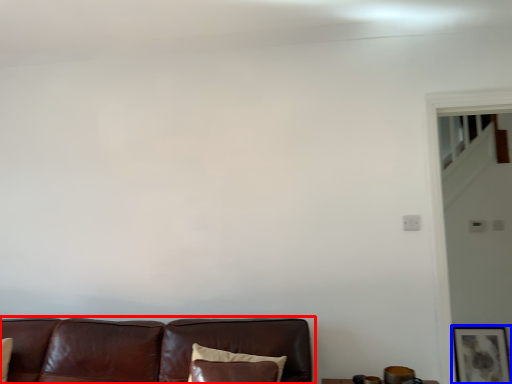
Question: Which point is further to the camera, studio couch (highlighted by a red box) or picture frame (highlighted by a blue box)?

Choices:
 (A) studio couch
 (B) picture frame

Answer: (B)